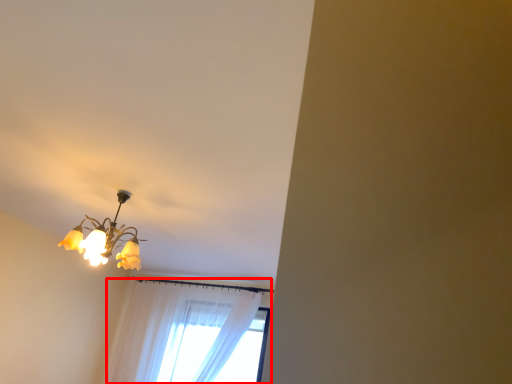
Question: Where is curtain (annotated by the red box) located in relation to lamp in the image?

Choices:
 (A) left
 (B) right

Answer: (B)